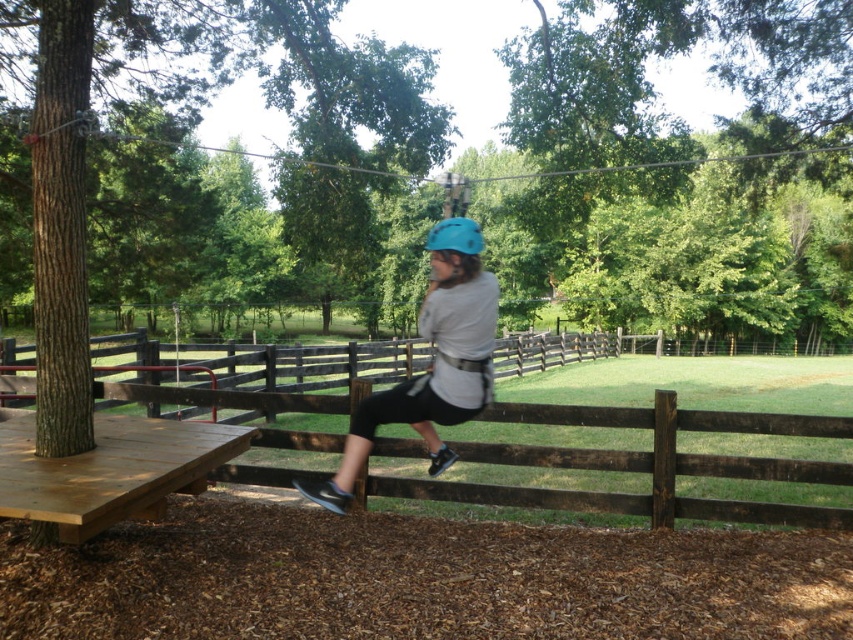
You are planning to set up a temporary tent for a small event in the adventure park. The brown wooden fence at center and the light brown wooden picnic table at lower left are already present. Based on their positions, which object should you avoid placing the tent near to ensure it is visible from the main path?

The light brown wooden picnic table at lower left should be avoided because the brown wooden fence at center is located above it, meaning the picnic table is lower and might block the view from the main path.

You are planning to set up a small tent between the brown wooden fence at center and the light brown wooden picnic table at lower left. The tent requires a minimum of 5 meters of space between the two objects to be safely installed. Based on the distance provided, can you determine if the space between them is sufficient for the tent setup?

The brown wooden fence at center is 4.04 meters away from the light brown wooden picnic table at lower left. Since the required minimum distance is 5 meters, the space between them is insufficient for the tent setup.

You are standing in an adventure park and see the light brown wooden picnic table at lower left. If you want to place a 3.5 feet long backpack on the table, will it fit?

The light brown wooden picnic table at lower left is 11.48 feet away from viewer. The distance does not affect the backpack length. However, the table itself must be at least 3.5 feet long. Since the table dimensions are not provided, we cannot confirm if the backpack will fit.